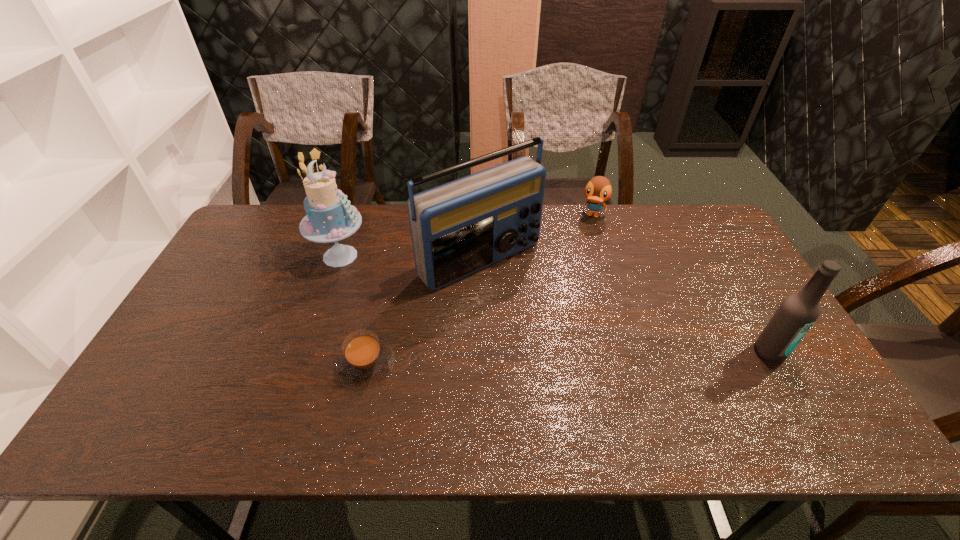
Image resolution: width=960 pixels, height=540 pixels. Identify the location of free space on the desktop that is between the shortest object and the beer bottle and is positioned on the front panel of the third object from left to right. (580, 358).

Identify the location of vacant space on the desktop that is between the shortest object and the rightmost object and is positioned with a ladder on the side of the cake. The image size is (960, 540). (529, 359).

Image resolution: width=960 pixels, height=540 pixels. Find the location of `free spot on the desktop that is between the cappuccino and the third tallest object and is positioned on the front-facing side of the duck`. free spot on the desktop that is between the cappuccino and the third tallest object and is positioned on the front-facing side of the duck is located at coordinates (x=538, y=359).